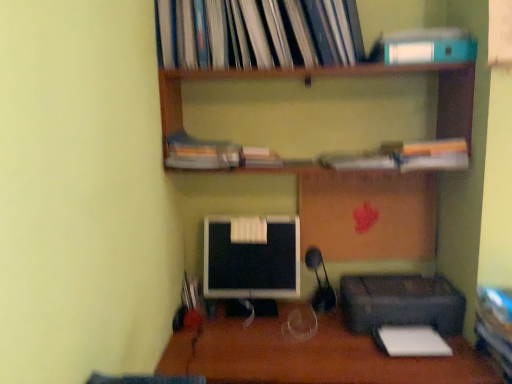
Question: Is there a large distance between hardcover book at upper center, which is the 2th book from top to bottom, and white paper at lower right?

Choices:
 (A) no
 (B) yes

Answer: (A)

Question: Can you confirm if hardcover book at upper center, which is the 2th book from top to bottom, is wider than white paper at lower right?

Choices:
 (A) yes
 (B) no

Answer: (A)

Question: Is hardcover book at upper center, which is the 2th book from top to bottom, facing towards white paper at lower right?

Choices:
 (A) yes
 (B) no

Answer: (B)

Question: Is hardcover book at upper center, the 3th book in the bottom-to-top sequence, positioned behind white paper at lower right?

Choices:
 (A) yes
 (B) no

Answer: (A)

Question: From the image's perspective, is hardcover book at upper center, which is the 2th book from top to bottom, on top of white paper at lower right?

Choices:
 (A) no
 (B) yes

Answer: (B)

Question: From the image's perspective, is hardcover book at upper center, the 3th book in the bottom-to-top sequence, beneath white paper at lower right?

Choices:
 (A) yes
 (B) no

Answer: (B)

Question: Considering the relative sizes of wooden shelves at upper center and hardcover book at center, the 1th book in the bottom-to-top sequence, in the image provided, is wooden shelves at upper center bigger than hardcover book at center, the 1th book in the bottom-to-top sequence,?

Choices:
 (A) no
 (B) yes

Answer: (B)

Question: Does wooden shelves at upper center have a greater height compared to hardcover book at center, the 1th book in the bottom-to-top sequence?

Choices:
 (A) no
 (B) yes

Answer: (B)

Question: Is wooden shelves at upper center thinner than hardcover book at center, which is the fourth book in top-to-bottom order?

Choices:
 (A) yes
 (B) no

Answer: (B)

Question: From the image's perspective, is wooden shelves at upper center over hardcover book at center, which is the fourth book in top-to-bottom order?

Choices:
 (A) no
 (B) yes

Answer: (B)

Question: Is wooden shelves at upper center with hardcover book at center, which is the fourth book in top-to-bottom order?

Choices:
 (A) no
 (B) yes

Answer: (A)

Question: Could you tell me if wooden shelves at upper center is turned towards hardcover book at center, which is the fourth book in top-to-bottom order?

Choices:
 (A) yes
 (B) no

Answer: (A)

Question: Considering the relative sizes of black glossy monitor at center and teal matte paperback book at upper right in the image provided, is black glossy monitor at center shorter than teal matte paperback book at upper right?

Choices:
 (A) no
 (B) yes

Answer: (A)